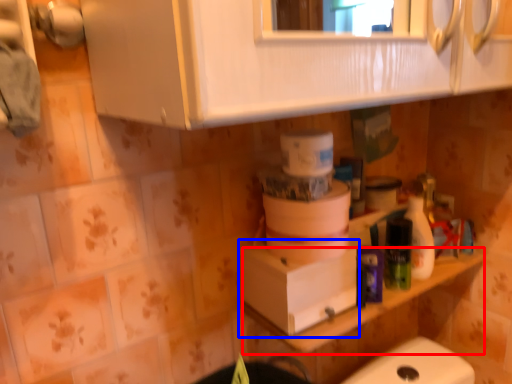
Question: Which object is further to the camera taking this photo, counter top (highlighted by a red box) or cardboard box (highlighted by a blue box)?

Choices:
 (A) counter top
 (B) cardboard box

Answer: (A)